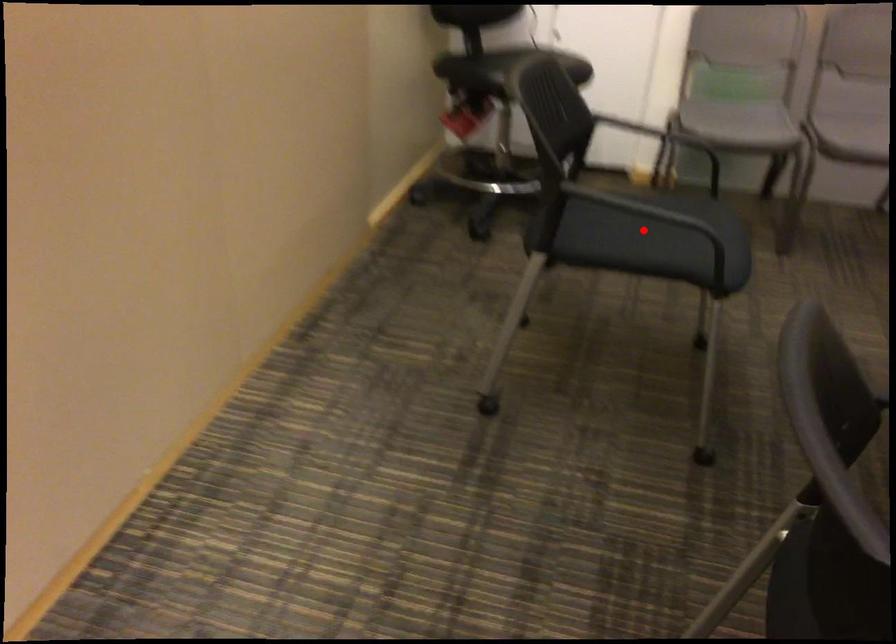
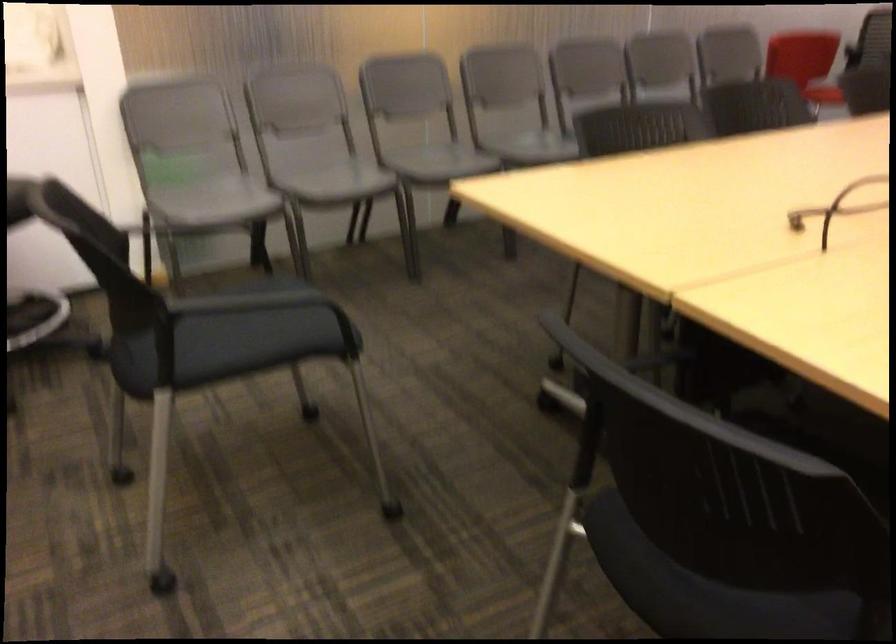
Where in the second image is the point corresponding to the highlighted location from the first image?

(235, 336)